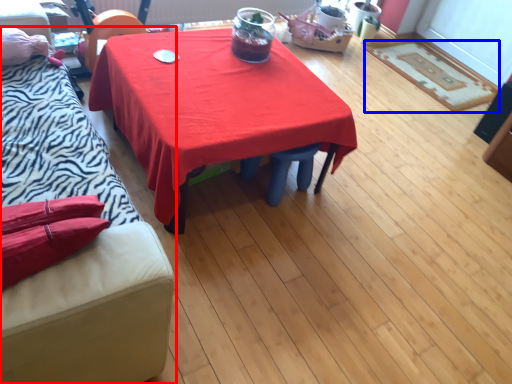
Question: Which object appears farthest to the camera in this image, studio couch (highlighted by a red box) or mat (highlighted by a blue box)?

Choices:
 (A) studio couch
 (B) mat

Answer: (B)